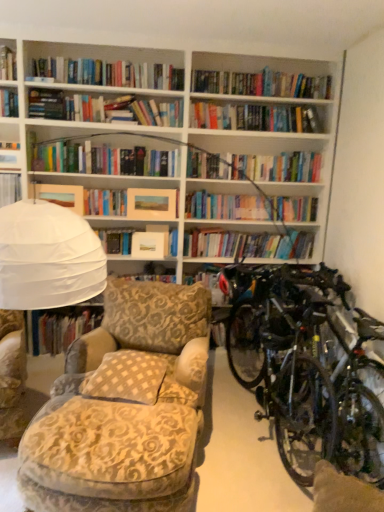
Question: Which direction should I rotate to face matte paper book at center, positioned as the 2th paperback book in right-to-left order, — up or down?

Choices:
 (A) down
 (B) up

Answer: (B)

Question: Considering the relative positions of matte paper book at center, positioned as the 2th paperback book in right-to-left order, and hardcover book at center, the 1th book positioned from the back, in the image provided, is matte paper book at center, positioned as the 2th paperback book in right-to-left order, in front of hardcover book at center, the 1th book positioned from the back,?

Choices:
 (A) yes
 (B) no

Answer: (B)

Question: Does matte paper book at center, marked as the second paperback book in a left-to-right arrangement, have a smaller size compared to hardcover book at center, acting as the first book starting from the right?

Choices:
 (A) yes
 (B) no

Answer: (A)

Question: Is matte paper book at center, positioned as the 2th paperback book in right-to-left order, surrounding hardcover book at center, the 1th book positioned from the bottom?

Choices:
 (A) yes
 (B) no

Answer: (B)

Question: Considering the relative sizes of matte paper book at center, positioned as the 2th paperback book in right-to-left order, and hardcover book at center, acting as the first book starting from the right, in the image provided, is matte paper book at center, positioned as the 2th paperback book in right-to-left order, shorter than hardcover book at center, acting as the first book starting from the right,?

Choices:
 (A) no
 (B) yes

Answer: (B)

Question: From the image's perspective, would you say matte paper book at center, marked as the second paperback book in a left-to-right arrangement, is positioned over hardcover book at center, the 1th book positioned from the back?

Choices:
 (A) yes
 (B) no

Answer: (A)

Question: Is matte paper book at center, positioned as the 2th paperback book in right-to-left order, oriented towards hardcover book at center, acting as the second book starting from the front?

Choices:
 (A) yes
 (B) no

Answer: (B)

Question: From the image's perspective, is matte paper book at center, marked as the second paperback book in a left-to-right arrangement, under beige textured pillow at center?

Choices:
 (A) yes
 (B) no

Answer: (B)

Question: Does matte paper book at center, marked as the second paperback book in a left-to-right arrangement, have a lesser height compared to beige textured pillow at center?

Choices:
 (A) no
 (B) yes

Answer: (A)

Question: Is there a large distance between matte paper book at center, marked as the second paperback book in a left-to-right arrangement, and beige textured pillow at center?

Choices:
 (A) no
 (B) yes

Answer: (B)

Question: Is matte paper book at center, marked as the second paperback book in a left-to-right arrangement, oriented towards beige textured pillow at center?

Choices:
 (A) yes
 (B) no

Answer: (A)

Question: Are matte paper book at center, marked as the second paperback book in a left-to-right arrangement, and beige textured pillow at center making contact?

Choices:
 (A) yes
 (B) no

Answer: (B)

Question: Does matte paper book at center, positioned as the 2th paperback book in right-to-left order, have a larger size compared to beige textured pillow at center?

Choices:
 (A) no
 (B) yes

Answer: (A)

Question: From a real-world perspective, is matte yellow paper at upper left, which is the 1th paperback book from left to right, physically above matte paper picture frame at center, the 1th paperback book in the right-to-left sequence?

Choices:
 (A) yes
 (B) no

Answer: (B)